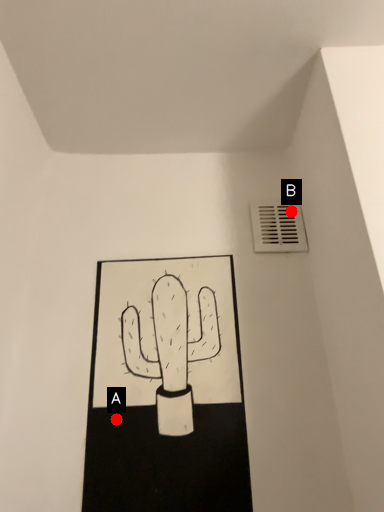
Question: Two points are circled on the image, labeled by A and B beside each circle. Which point is closer to the camera?

Choices:
 (A) A is closer
 (B) B is closer

Answer: (A)